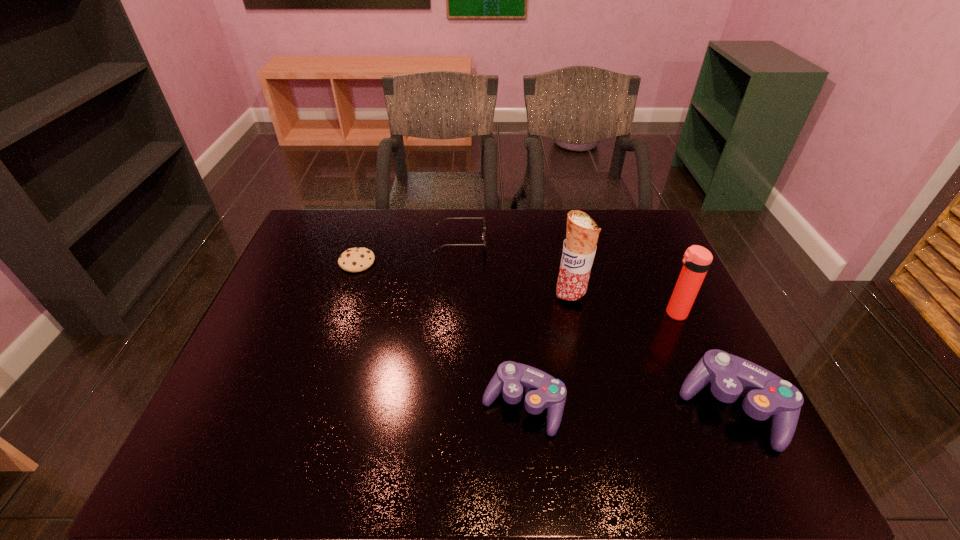
You are a GUI agent. You are given a task and a screenshot of the screen. Output one action in this format:
    pyautogui.click(x=<x>, y=<y>)
    Task: Click on the object that is at the near right corner
    The height and width of the screenshot is (540, 960).
    Given the screenshot: What is the action you would take?
    pyautogui.click(x=765, y=394)

In order to click on free space at the far edge of the desktop in this screenshot , I will do `click(564, 227)`.

At what (x,y) coordinates should I click in order to perform the action: click on vacant space at the near edge of the desktop. Please return your answer as a coordinate pair (x, y). This screenshot has width=960, height=540. Looking at the image, I should click on (x=642, y=420).

Where is `free region at the left edge`? This screenshot has width=960, height=540. free region at the left edge is located at coordinates (292, 265).

I want to click on blank space at the right edge, so click(663, 372).

Image resolution: width=960 pixels, height=540 pixels. In the image, there is a desktop. What are the coordinates of `free space at the near left corner` in the screenshot? It's located at (273, 418).

Locate an element on the screen. Image resolution: width=960 pixels, height=540 pixels. vacant area at the far right corner is located at coordinates (613, 208).

The height and width of the screenshot is (540, 960). I want to click on vacant area that lies between the second shortest object and the shortest object, so click(x=409, y=252).

This screenshot has width=960, height=540. In order to click on vacant space that is in between the shortest object and the fourth tallest object in this screenshot , I will do `click(440, 334)`.

Identify the location of free area in between the fourth tallest object and the burrito. The image size is (960, 540). (546, 351).